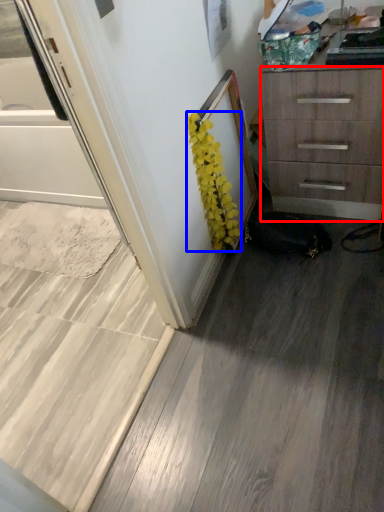
Question: Which of the following is the farthest to the observer, chest of drawers (highlighted by a red box) or flower (highlighted by a blue box)?

Choices:
 (A) chest of drawers
 (B) flower

Answer: (B)